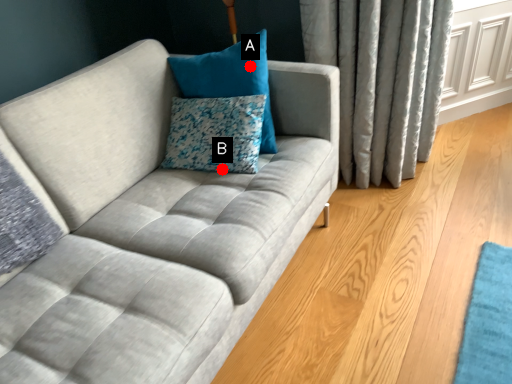
Question: Two points are circled on the image, labeled by A and B beside each circle. Which point is closer to the camera?

Choices:
 (A) A is closer
 (B) B is closer

Answer: (B)